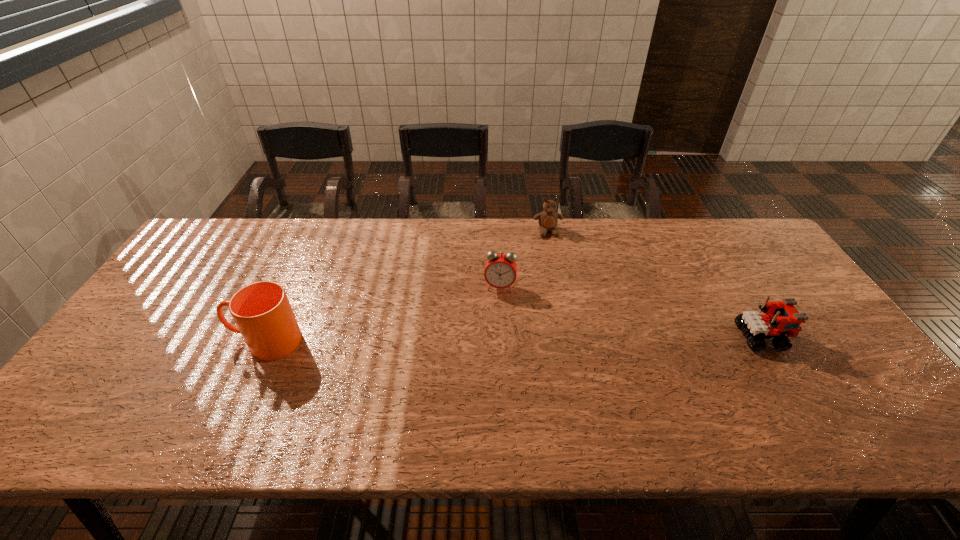
In order to click on free space on the desktop that is between the leftmost object and the Lego and is positioned on the front-facing side of the second farthest object in this screenshot , I will do `click(493, 340)`.

I want to click on free space on the desktop that is between the leftmost object and the rightmost object and is positioned on the front-facing side of the farthest object, so click(x=576, y=339).